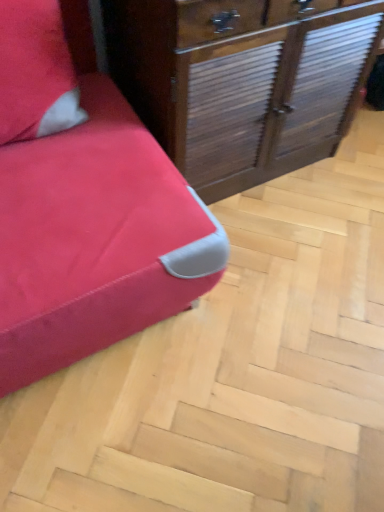
Question: Considering the relative positions of wooden with slats chest of drawers at center and matte red sofa at left in the image provided, is wooden with slats chest of drawers at center to the left of matte red sofa at left from the viewer's perspective?

Choices:
 (A) no
 (B) yes

Answer: (A)

Question: Is wooden with slats chest of drawers at center at the right side of matte red sofa at left?

Choices:
 (A) no
 (B) yes

Answer: (B)

Question: Is wooden with slats chest of drawers at center turned away from matte red sofa at left?

Choices:
 (A) no
 (B) yes

Answer: (A)

Question: Can you confirm if wooden with slats chest of drawers at center is bigger than matte red sofa at left?

Choices:
 (A) no
 (B) yes

Answer: (A)

Question: Could you tell me if wooden with slats chest of drawers at center is facing matte red sofa at left?

Choices:
 (A) no
 (B) yes

Answer: (A)

Question: Would you say wooden with slats chest of drawers at center contains matte red sofa at left?

Choices:
 (A) no
 (B) yes

Answer: (A)

Question: From the image's perspective, is matte red sofa at left under wooden with slats chest of drawers at center?

Choices:
 (A) no
 (B) yes

Answer: (B)

Question: Is matte red sofa at left aimed at wooden with slats chest of drawers at center?

Choices:
 (A) yes
 (B) no

Answer: (B)

Question: Can you confirm if matte red sofa at left is positioned to the right of wooden with slats chest of drawers at center?

Choices:
 (A) no
 (B) yes

Answer: (A)

Question: Can you confirm if matte red sofa at left is shorter than wooden with slats chest of drawers at center?

Choices:
 (A) no
 (B) yes

Answer: (B)

Question: Can you confirm if matte red sofa at left is smaller than wooden with slats chest of drawers at center?

Choices:
 (A) yes
 (B) no

Answer: (B)

Question: Is matte red sofa at left completely or partially outside of wooden with slats chest of drawers at center?

Choices:
 (A) yes
 (B) no

Answer: (A)

Question: From a real-world perspective, is wooden with slats chest of drawers at center above or below matte red sofa at left?

Choices:
 (A) below
 (B) above

Answer: (B)